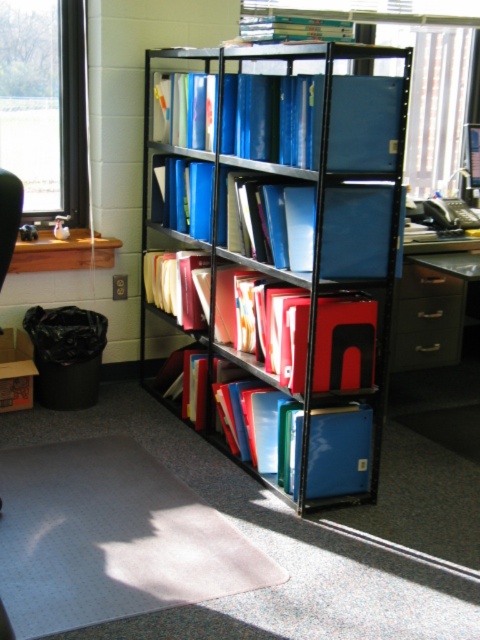
You are an office worker who needs to reach both the matte yellow folder at center and the metallic drawer at center. If you can only move 1 meter forward, which item will you be able to reach first?

The matte yellow folder at center is 1.27 meters from the metallic drawer at center. Since you can only move 1 meter forward, you won the reach either item.

You are standing in the office and need to reach the blue plastic folders at center to retrieve a file. Considering your height and arm length, can you comfortably reach them without needing a stool?

The blue plastic folders at center are 2.24 meters away from camera. Since the distance is horizontal, not vertical, the height of the folders isn

You are standing in the office and want to reach both the point at coordinates point (444, 380) and point (180, 314). Which point will you touch first if you move your hand from your current position towards the shelving unit?

You will touch point (444, 380) first because it is closer to you than point (180, 314), which is further away.